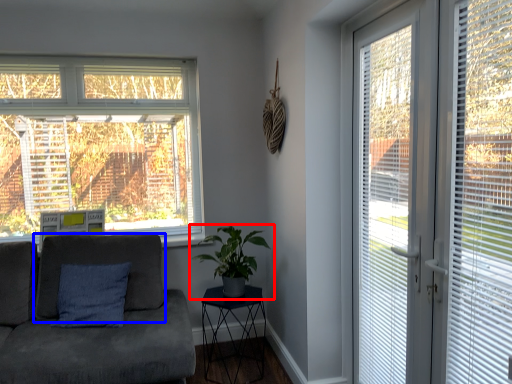
Question: Which object appears closest to the camera in this image, houseplant (highlighted by a red box) or swivel chair (highlighted by a blue box)?

Choices:
 (A) houseplant
 (B) swivel chair

Answer: (A)